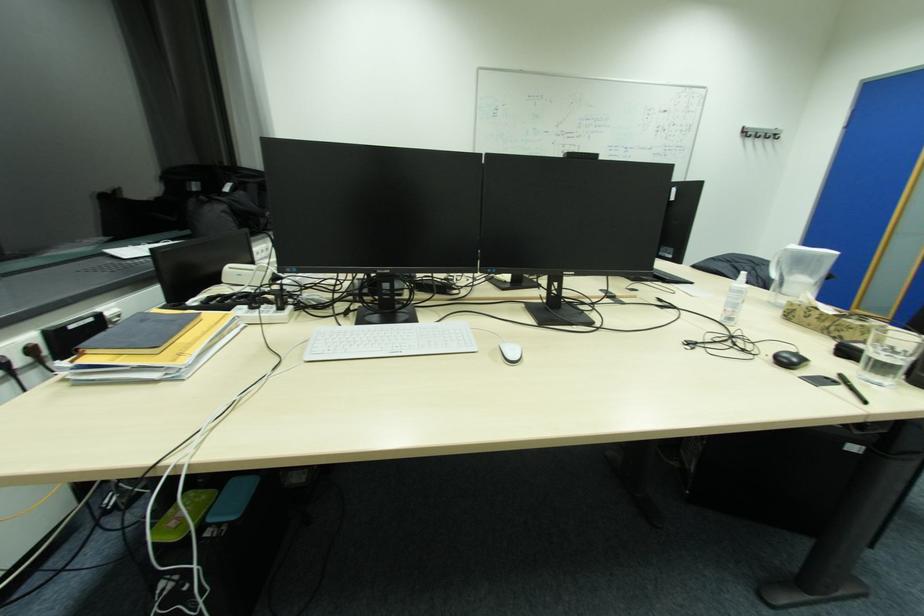
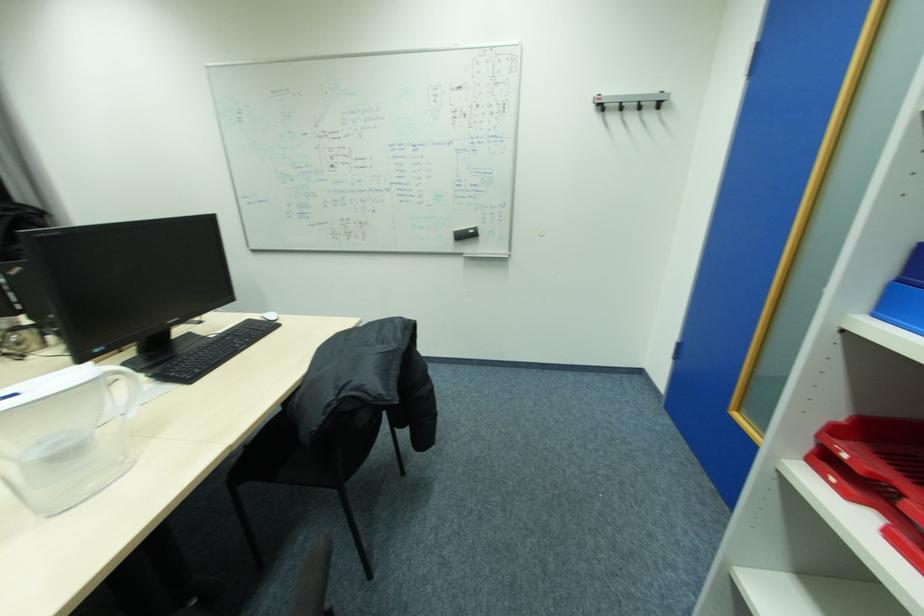
The images are taken continuously from a first-person perspective. In which direction are you moving?

The cameraman walked toward right, forward.